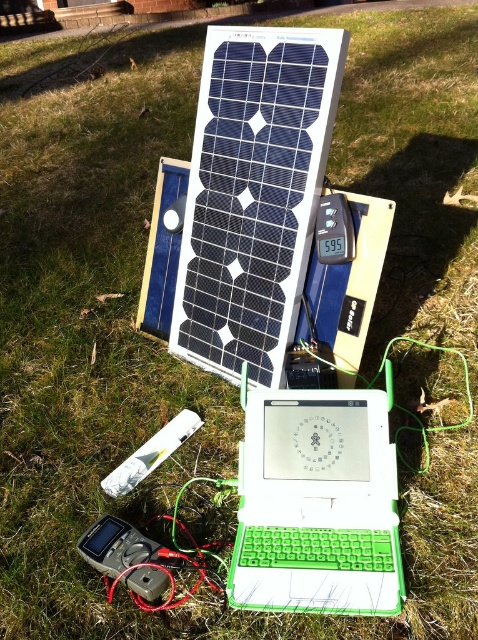
You are a technician who needs to reach the green plastic laptop at center to check its connection. You are currently 1.5 meters away from it. Can you comfortably reach it without moving your position?

The green plastic laptop at center is 1.34 meters away from the camera, so since you are 1.5 meters away, you can comfortably reach it without moving your position.

You are setting up a portable solar energy system. You need to connect the green plastic laptop at center to the gray plastic multimeter at lower left. What is the minimum length of cable you need to ensure a secure connection?

The minimum cable length needed is at least 15.17 inches to cover the distance between the green plastic laptop at center and the gray plastic multimeter at lower left.

From the picture: You are a technician who needs to access both the green plastic laptop at center and the gray plastic multimeter at lower left. Which object is closer to you when you are standing in front of the setup?

The green plastic laptop at center is closer to you because it is in front of the gray plastic multimeter at lower left.